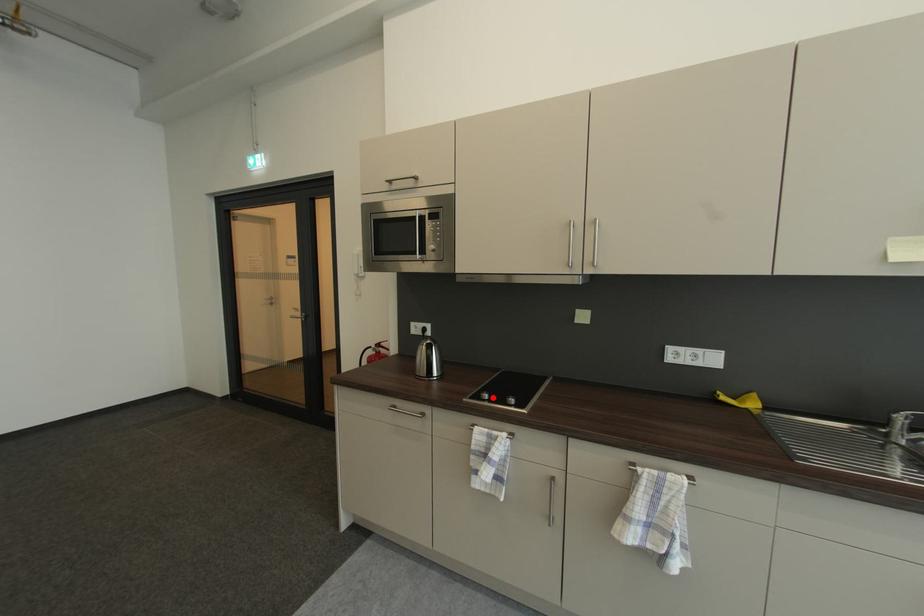
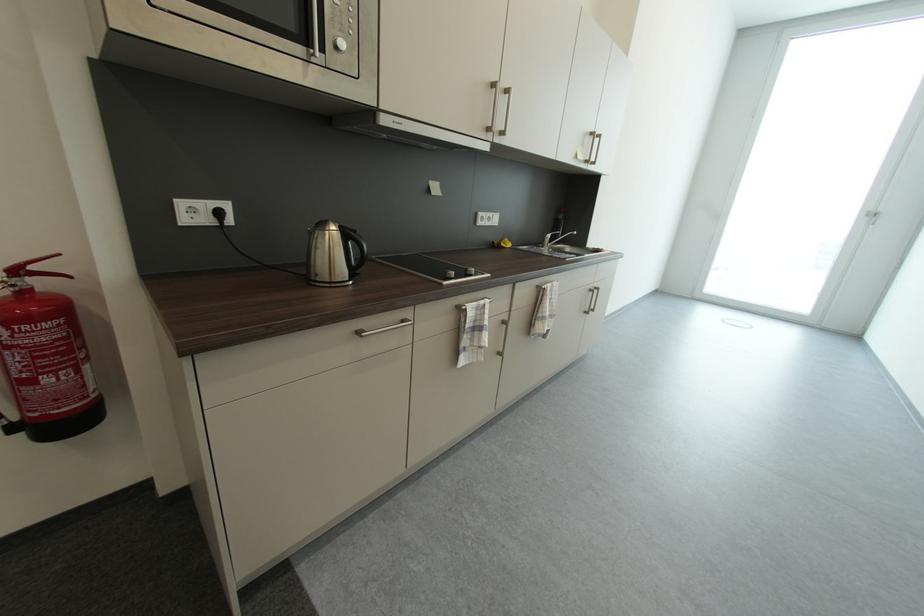
In the second image, find the point that corresponds to the highlighted location in the first image.

(458, 275)